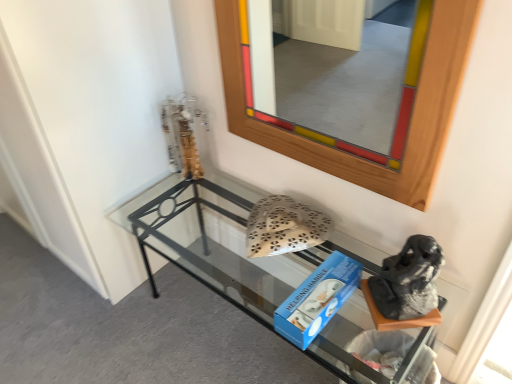
Question: Is gray fabric boot at lower right shorter than metallic gold sculpture at upper left?

Choices:
 (A) yes
 (B) no

Answer: (A)

Question: From a real-world perspective, is gray fabric boot at lower right beneath metallic gold sculpture at upper left?

Choices:
 (A) yes
 (B) no

Answer: (A)

Question: From the image's perspective, is gray fabric boot at lower right on top of metallic gold sculpture at upper left?

Choices:
 (A) no
 (B) yes

Answer: (A)

Question: Does gray fabric boot at lower right have a smaller size compared to metallic gold sculpture at upper left?

Choices:
 (A) yes
 (B) no

Answer: (B)

Question: From a real-world perspective, is gray fabric boot at lower right over metallic gold sculpture at upper left?

Choices:
 (A) no
 (B) yes

Answer: (A)

Question: Choose the correct answer: Is clear glass shelf at lower center inside gray fabric boot at lower right or outside it?

Choices:
 (A) inside
 (B) outside

Answer: (B)

Question: Looking at their shapes, would you say clear glass shelf at lower center is wider or thinner than gray fabric boot at lower right?

Choices:
 (A) thin
 (B) wide

Answer: (B)

Question: From a real-world perspective, relative to gray fabric boot at lower right, is clear glass shelf at lower center vertically above or below?

Choices:
 (A) below
 (B) above

Answer: (A)

Question: From the image's perspective, is clear glass shelf at lower center above or below gray fabric boot at lower right?

Choices:
 (A) below
 (B) above

Answer: (A)

Question: From a real-world perspective, is gray fabric boot at lower right positioned above or below clear glass shelf at lower center?

Choices:
 (A) above
 (B) below

Answer: (A)

Question: In terms of width, does gray fabric boot at lower right look wider or thinner when compared to clear glass shelf at lower center?

Choices:
 (A) wide
 (B) thin

Answer: (B)

Question: Does point (371, 288) appear closer or farther from the camera than point (295, 269)?

Choices:
 (A) farther
 (B) closer

Answer: (B)

Question: From the image's perspective, is gray fabric boot at lower right positioned above or below clear glass shelf at lower center?

Choices:
 (A) above
 (B) below

Answer: (A)

Question: In terms of height, does gray fabric boot at lower right look taller or shorter compared to metallic gold sculpture at upper left?

Choices:
 (A) tall
 (B) short

Answer: (B)

Question: Is point (430, 309) closer or farther from the camera than point (163, 114)?

Choices:
 (A) farther
 (B) closer

Answer: (B)